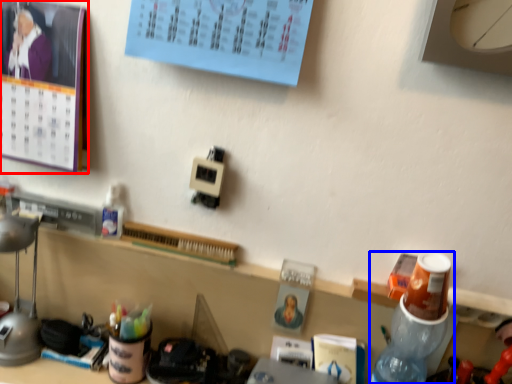
Question: Which of the following is the closest to the observer, bulletin board (highlighted by a red box) or bottle (highlighted by a blue box)?

Choices:
 (A) bulletin board
 (B) bottle

Answer: (B)